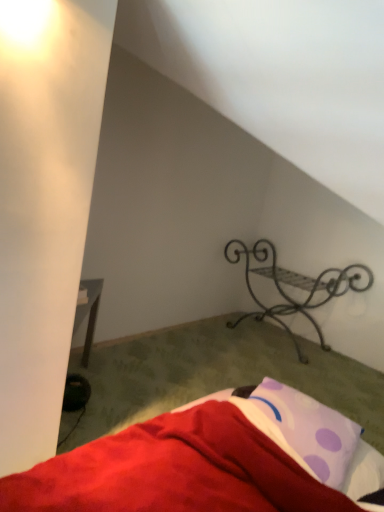
Question: Does point coord(317,333) appear closer or farther from the camera than point coord(281,440)?

Choices:
 (A) closer
 (B) farther

Answer: (B)

Question: Choose the correct answer: Is black wrought iron shelf at upper right inside purple dotted pillow at lower right or outside it?

Choices:
 (A) outside
 (B) inside

Answer: (A)

Question: Estimate the real-world distances between objects in this image. Which object is farther from the black wrought iron shelf at upper right?

Choices:
 (A) red soft fabric bed at lower right
 (B) purple dotted pillow at lower right

Answer: (A)

Question: Which object is the closest to the purple dotted pillow at lower right?

Choices:
 (A) red soft fabric bed at lower right
 (B) black wrought iron shelf at upper right

Answer: (A)